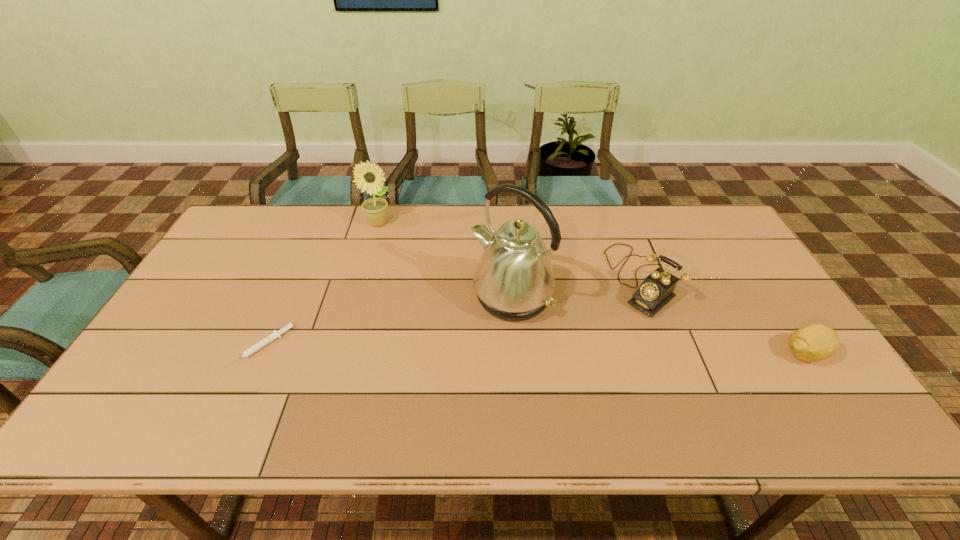
This screenshot has width=960, height=540. I want to click on sunflower located in the far edge section of the desktop, so click(369, 176).

I want to click on telephone at the far edge, so click(x=656, y=290).

At what (x,y) coordinates should I click in order to perform the action: click on syringe located at the near edge. Please return your answer as a coordinate pair (x, y). Looking at the image, I should click on (275, 334).

Locate an element on the screen. The image size is (960, 540). lemon located in the near edge section of the desktop is located at coordinates (816, 342).

The image size is (960, 540). Identify the location of object that is at the right edge. (816, 342).

The width and height of the screenshot is (960, 540). In order to click on object that is at the near right corner in this screenshot , I will do `click(816, 342)`.

Locate an element on the screen. The width and height of the screenshot is (960, 540). free space at the far edge is located at coordinates (582, 230).

I want to click on vacant space at the near edge, so click(x=618, y=373).

Identify the location of vacant point at the left edge. (229, 292).

Identify the location of vacant area at the right edge. (746, 277).